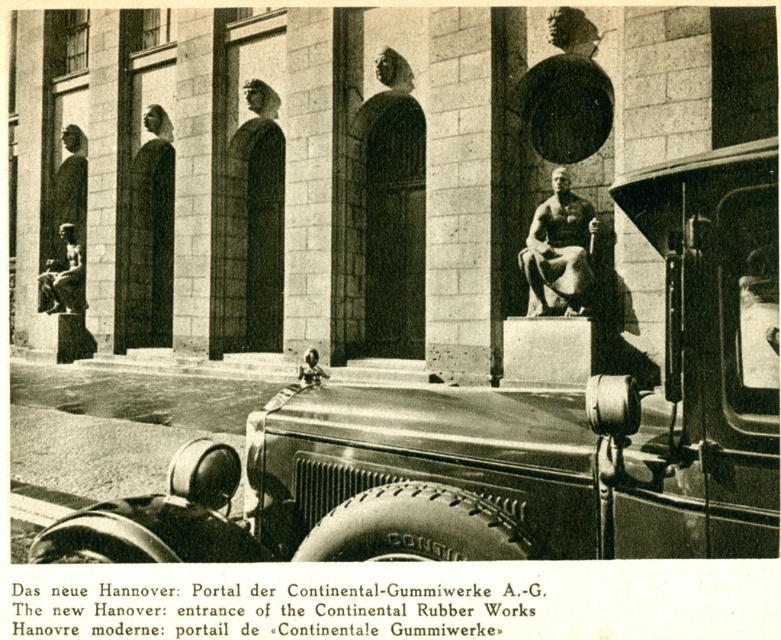
Which is above, shiny chrome car at center or matte bronze statue at center?

matte bronze statue at center is above.

Does shiny chrome car at center appear under matte bronze statue at center?

Yes, shiny chrome car at center is below matte bronze statue at center.

Is point (352, 444) more distant than point (62, 296)?

No, (352, 444) is in front of (62, 296).

This screenshot has height=640, width=781. What are the coordinates of `shiny chrome car at center` in the screenshot? It's located at (532, 428).

Image resolution: width=781 pixels, height=640 pixels. What do you see at coordinates (560, 250) in the screenshot?
I see `polished bronze statue at center` at bounding box center [560, 250].

Can you confirm if polished bronze statue at center is positioned to the left of matte bronze statue at center?

In fact, polished bronze statue at center is to the right of matte bronze statue at center.

At what (x,y) coordinates should I click in order to perform the action: click on polished bronze statue at center. Please return your answer as a coordinate pair (x, y). Looking at the image, I should click on (560, 250).

Is shiny chrome car at center positioned before polished bronze statue at center?

That is True.

What do you see at coordinates (532, 428) in the screenshot?
I see `shiny chrome car at center` at bounding box center [532, 428].

Locate an element on the screen. The height and width of the screenshot is (640, 781). shiny chrome car at center is located at coordinates (532, 428).